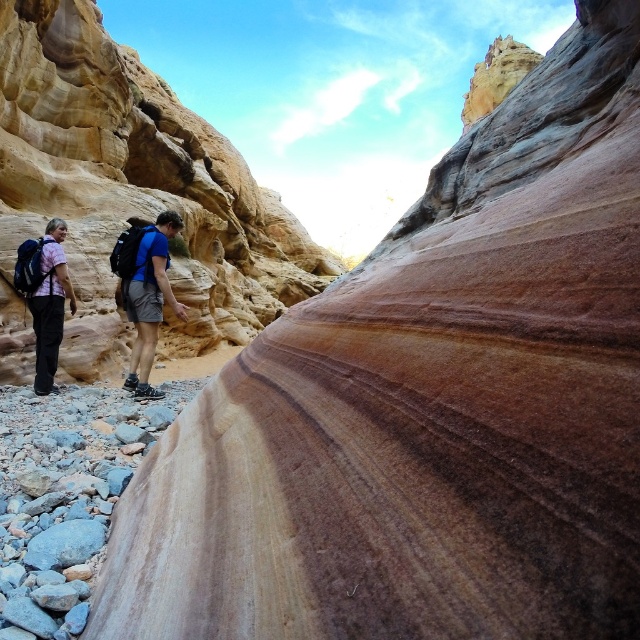
You are a hiker in the canyon and want to take a photo of the matte pink shirt at left and the blue fabric backpack at center. Which object should you focus on first to ensure both are in the frame?

You should focus on the blue fabric backpack at center first because the matte pink shirt at left is behind it, ensuring both will be visible in the frame.

You are standing at the origin point in the canyon scene. A hiker wearing a matte blue shirt at center is located at coordinates 0.455, 0.228. If you want to move towards the hiker, in which cardinal direction should you head?

The matte blue shirt at center is located at coordinates (145,291). Since the y coordinate is 0.228, which is below the midpoint of 0.5, you should move north to reach the hiker.

You are a hiker trying to locate your friend in the canyon. You see the point at coordinates (145, 291) and know your friend is wearing a blue shirt. Is your friend at that point?

→ The matte blue shirt at center is located at point (145, 291), so yes, your friend wearing the blue shirt is at that point.